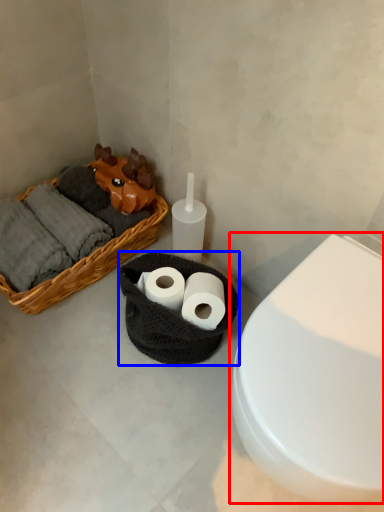
Question: Which point is closer to the camera, toilet (highlighted by a red box) or basket container (highlighted by a blue box)?

Choices:
 (A) toilet
 (B) basket container

Answer: (A)